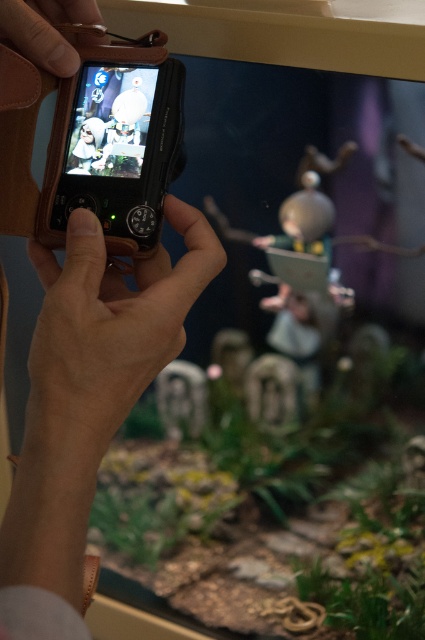
Which is more to the right, leather at center or leather at upper left?

From the viewer's perspective, leather at center appears more on the right side.

Can you confirm if leather at center is positioned to the right of leather at upper left?

Yes, leather at center is to the right of leather at upper left.

Who is more distant from viewer, (108, 410) or (53, 22)?

Point (53, 22)

What are the coordinates of `leather at center` in the screenshot? It's located at (107, 328).